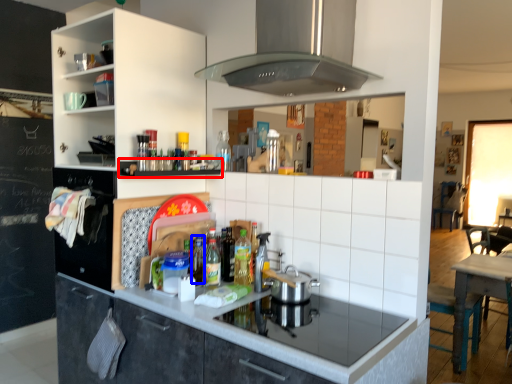
Question: Which point is further to the camera, shelf (highlighted by a red box) or bottle (highlighted by a blue box)?

Choices:
 (A) shelf
 (B) bottle

Answer: (B)